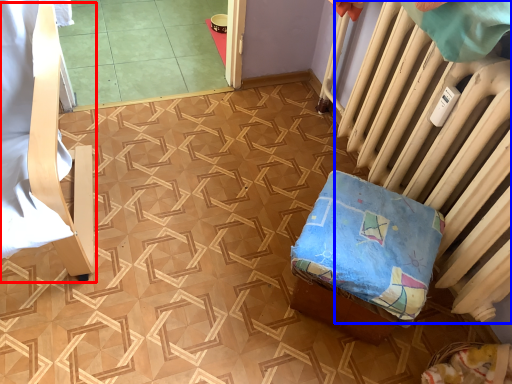
Question: Which object is closer to the camera taking this photo, furniture (highlighted by a red box) or radiator (highlighted by a blue box)?

Choices:
 (A) furniture
 (B) radiator

Answer: (A)